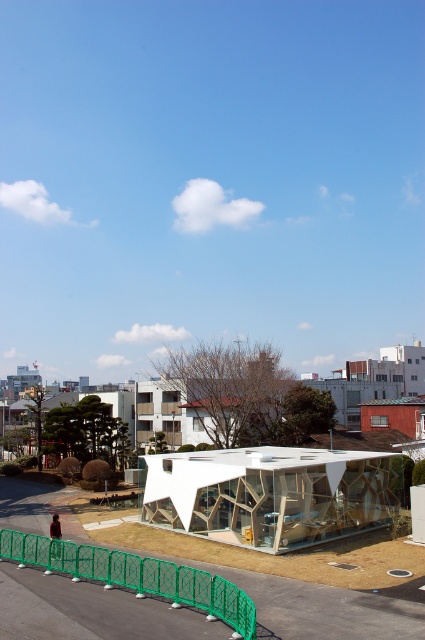
You are standing at the camera position and want to reach point (269, 545). Is this point within a 100 feet walking distance?

The distance of point (269, 545) from camera is 90.04 feet, so yes, it is within 100 feet walking distance.